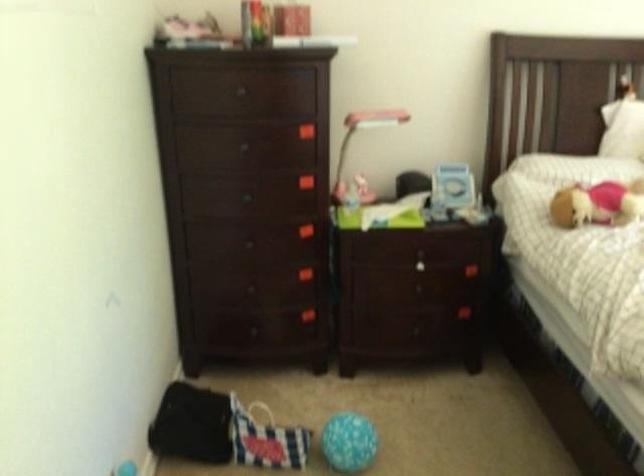
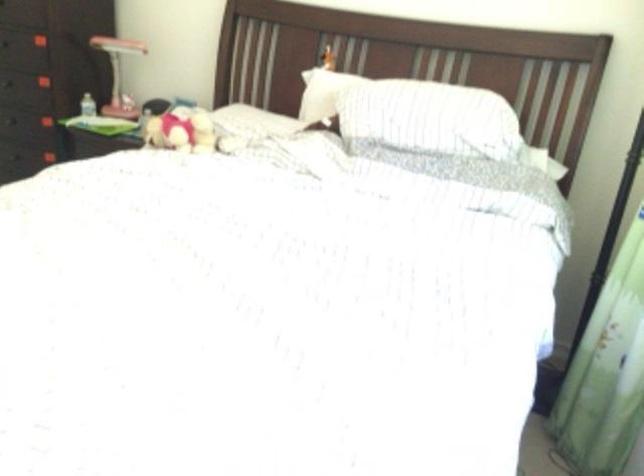
Question: What movement of the cameraman would produce the second image?

Choices:
 (A) Left
 (B) Right
 (C) Forward
 (D) Backward

Answer: (B)